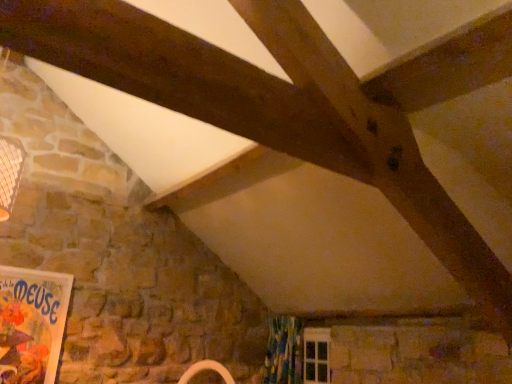
Describe the element at coordinates (32, 324) in the screenshot. This screenshot has width=512, height=384. I see `matte paper poster at lower left` at that location.

Where is `matte paper poster at lower left`? matte paper poster at lower left is located at coordinates (32, 324).

The image size is (512, 384). Describe the element at coordinates (284, 351) in the screenshot. I see `textured floral curtain at lower center` at that location.

Where is `textured floral curtain at lower center`? The width and height of the screenshot is (512, 384). textured floral curtain at lower center is located at coordinates (284, 351).

Where is `matte paper poster at lower left`? The width and height of the screenshot is (512, 384). matte paper poster at lower left is located at coordinates (32, 324).

Which object is positioned more to the left, matte paper poster at lower left or textured floral curtain at lower center?

Positioned to the left is matte paper poster at lower left.

In the scene shown: Is the position of matte paper poster at lower left less distant than that of textured floral curtain at lower center?

Yes, matte paper poster at lower left is closer to the viewer.

Considering the positions of points (18, 370) and (282, 347), is point (18, 370) closer to camera compared to point (282, 347)?

Yes, it is.

From the image's perspective, is matte paper poster at lower left over textured floral curtain at lower center?

Indeed, from the image's perspective, matte paper poster at lower left is shown above textured floral curtain at lower center.

From a real-world perspective, is matte paper poster at lower left over textured floral curtain at lower center?

Correct, in the physical world, matte paper poster at lower left is higher than textured floral curtain at lower center.

Considering the sizes of objects matte paper poster at lower left and textured floral curtain at lower center in the image provided, who is thinner, matte paper poster at lower left or textured floral curtain at lower center?

matte paper poster at lower left.

Between matte paper poster at lower left and textured floral curtain at lower center, which one has more height?

With more height is matte paper poster at lower left.

Is matte paper poster at lower left bigger than textured floral curtain at lower center?

Actually, matte paper poster at lower left might be smaller than textured floral curtain at lower center.

Is matte paper poster at lower left not within textured floral curtain at lower center?

Yes, matte paper poster at lower left is not within textured floral curtain at lower center.

Is matte paper poster at lower left not near textured floral curtain at lower center?

matte paper poster at lower left is far away from textured floral curtain at lower center.

Is matte paper poster at lower left oriented away from textured floral curtain at lower center?

matte paper poster at lower left does not have its back to textured floral curtain at lower center.

Identify the location of curtain to the right of matte paper poster at lower left. coord(284,351).

Can you confirm if textured floral curtain at lower center is positioned to the left of matte paper poster at lower left?

No, textured floral curtain at lower center is not to the left of matte paper poster at lower left.

Is textured floral curtain at lower center positioned in front of matte paper poster at lower left?

No, textured floral curtain at lower center is further to the viewer.

Is point (274, 378) positioned in front of point (40, 380)?

No.

From the image's perspective, which is below, textured floral curtain at lower center or matte paper poster at lower left?

textured floral curtain at lower center, from the image's perspective.

From a real-world perspective, is textured floral curtain at lower center below matte paper poster at lower left?

Indeed, from a real-world perspective, textured floral curtain at lower center is positioned beneath matte paper poster at lower left.

Looking at their sizes, would you say textured floral curtain at lower center is wider or thinner than matte paper poster at lower left?

Considering their sizes, textured floral curtain at lower center looks broader than matte paper poster at lower left.

Does textured floral curtain at lower center have a lesser height compared to matte paper poster at lower left?

Correct, textured floral curtain at lower center is not as tall as matte paper poster at lower left.

Considering the sizes of objects textured floral curtain at lower center and matte paper poster at lower left in the image provided, who is bigger, textured floral curtain at lower center or matte paper poster at lower left?

textured floral curtain at lower center is bigger.

Would you say textured floral curtain at lower center contains matte paper poster at lower left?

Definitely not — matte paper poster at lower left is not inside textured floral curtain at lower center.

Does textured floral curtain at lower center touch matte paper poster at lower left?

No, textured floral curtain at lower center is not beside matte paper poster at lower left.

Could you tell me if textured floral curtain at lower center is turned towards matte paper poster at lower left?

Yes.

Measure the distance from textured floral curtain at lower center to matte paper poster at lower left.

A distance of 1.78 meters exists between textured floral curtain at lower center and matte paper poster at lower left.

Locate an element on the screen. This screenshot has width=512, height=384. curtain behind the matte paper poster at lower left is located at coordinates (284, 351).

The image size is (512, 384). What are the coordinates of `curtain below the matte paper poster at lower left (from the image's perspective)` in the screenshot? It's located at (284, 351).

This screenshot has width=512, height=384. What are the coordinates of `bulletin board above the textured floral curtain at lower center (from a real-world perspective)` in the screenshot? It's located at (32, 324).